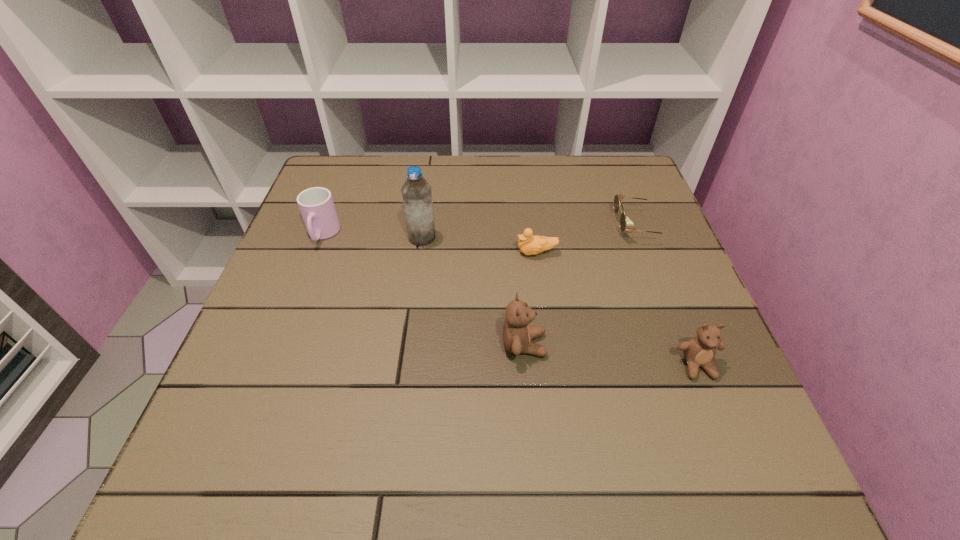
Find the location of `the taller teddy bear`. the taller teddy bear is located at coordinates point(517,334).

Identify the location of the fifth shortest object. The height and width of the screenshot is (540, 960). (517, 334).

Where is `the right teddy bear`? the right teddy bear is located at coordinates (699, 351).

This screenshot has width=960, height=540. I want to click on duckling, so click(529, 245).

This screenshot has width=960, height=540. What are the coordinates of `the second object from left to right` in the screenshot? It's located at (416, 192).

This screenshot has width=960, height=540. I want to click on water bottle, so click(x=416, y=192).

Identify the location of cup. (316, 205).

You are a GUI agent. You are given a task and a screenshot of the screen. Output one action in this format:
    pyautogui.click(x=<x>, y=<y>)
    Task: Click on the sunglasses
    The image size is (960, 540).
    Given the screenshot: What is the action you would take?
    pyautogui.click(x=618, y=198)

At what (x,y) coordinates should I click in order to perform the action: click on blank area located 0.050m on the front-facing side of the second tallest object. Please return your answer as a coordinate pair (x, y). This screenshot has width=960, height=540. Looking at the image, I should click on (572, 345).

Where is `blank space located 0.050m on the front-facing side of the right teddy bear`? Image resolution: width=960 pixels, height=540 pixels. blank space located 0.050m on the front-facing side of the right teddy bear is located at coordinates (714, 408).